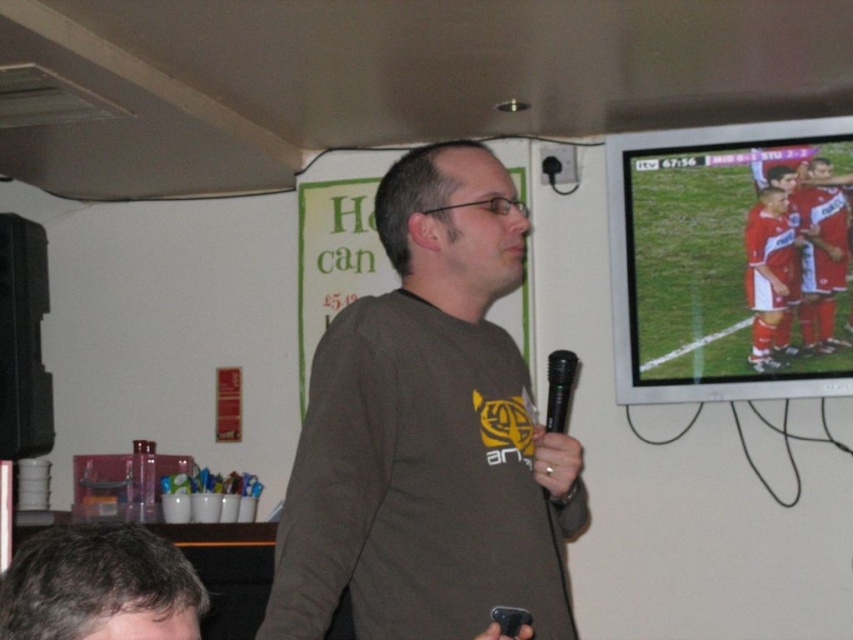
You are a photographer standing in the room and want to take a photo of the black metallic microphone at center and the red fabric soccer players at upper right. Which object should you focus on first if you want to capture both in the same frame without moving the camera?

The red fabric soccer players at upper right is much taller than the black metallic microphone at center, so you should focus on the red fabric soccer players at upper right first to ensure both are in the frame.

From the picture: You are an event organizer setting up a live commentary booth. You need to position a black metallic microphone at center so that the commentator can see the red fabric soccer players at upper right on the TV screen. Is the current position of the microphone allowing the commentator to see the soccer players?

The red fabric soccer players at upper right are to the right of the black metallic microphone at center, so the commentator holding the microphone can see the soccer players on the TV screen as they are positioned to the right of the microphone.